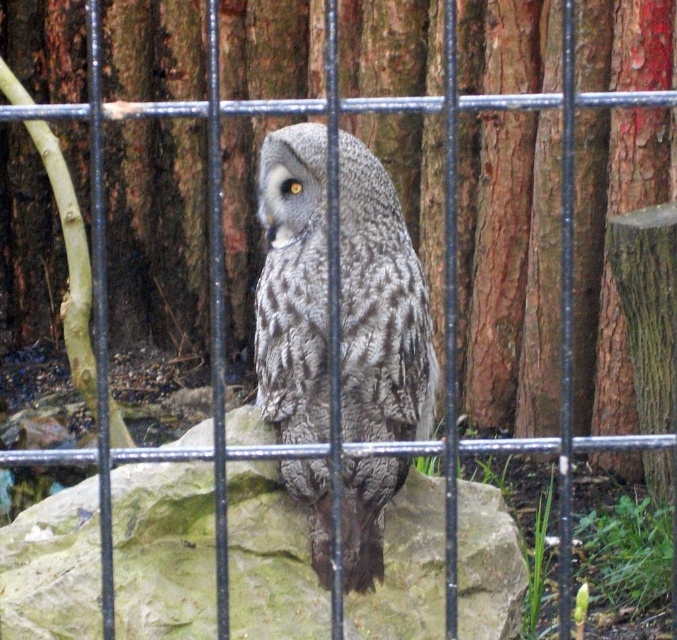
Question: Does gray rough stone at center appear over gray textured owl at center?

Choices:
 (A) no
 (B) yes

Answer: (A)

Question: Among these points, which one is nearest to the camera?

Choices:
 (A) (26, 632)
 (B) (414, 420)

Answer: (A)

Question: Is gray rough stone at center behind gray textured owl at center?

Choices:
 (A) yes
 (B) no

Answer: (A)

Question: Does gray rough stone at center have a smaller size compared to gray textured owl at center?

Choices:
 (A) yes
 (B) no

Answer: (B)

Question: Which point is closer to the camera taking this photo?

Choices:
 (A) (5, 554)
 (B) (366, 582)

Answer: (B)